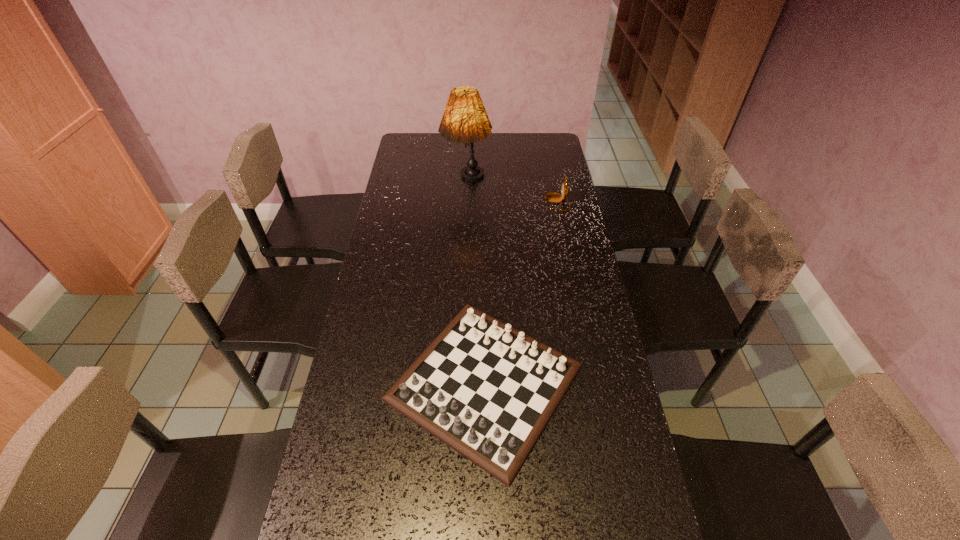
The width and height of the screenshot is (960, 540). Find the location of `lampshade`. lampshade is located at coordinates (465, 120).

Where is `the second tallest object`? The height and width of the screenshot is (540, 960). the second tallest object is located at coordinates (550, 197).

Find the location of a particular element. This screenshot has height=540, width=960. chessboard is located at coordinates (x=487, y=390).

The image size is (960, 540). I want to click on the shortest object, so click(487, 390).

The height and width of the screenshot is (540, 960). I want to click on free point located on the front-facing side of the tallest object, so click(x=466, y=217).

Identify the location of free region located on the face of the pocket watch. (469, 202).

Locate an element on the screen. vacant region located 0.340m on the face of the pocket watch is located at coordinates (462, 202).

Find the location of a particular element. free location located on the face of the pocket watch is located at coordinates (509, 202).

Where is `free spot located on the back of the chessboard`? free spot located on the back of the chessboard is located at coordinates point(484,243).

Identify the location of object that is positioned at the left edge. (487, 390).